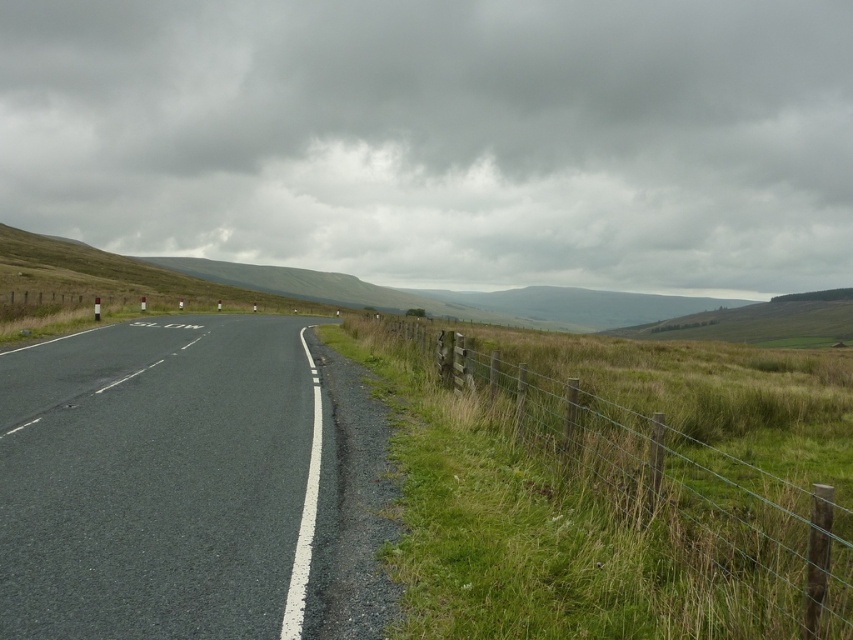
Is point (10, 369) behind point (560, 442)?

Yes, it is.

Locate an element on the screen. Image resolution: width=853 pixels, height=640 pixels. asphalt road at center is located at coordinates (163, 481).